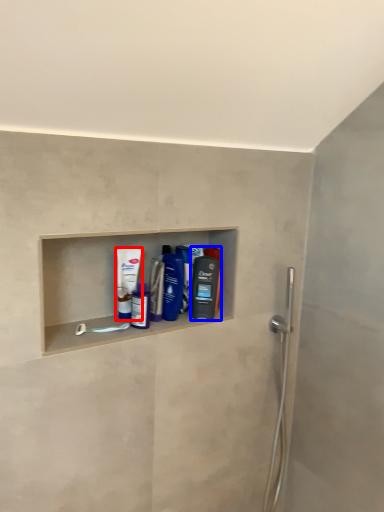
Question: Which object appears closest to the camera in this image, mouthwash (highlighted by a red box) or mouthwash (highlighted by a blue box)?

Choices:
 (A) mouthwash
 (B) mouthwash

Answer: (A)